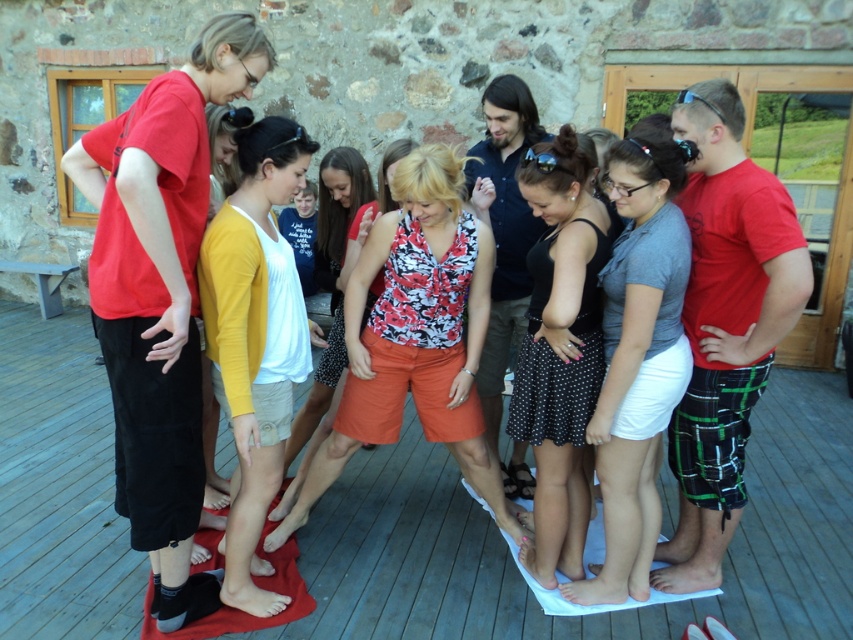
Consider the image. You are a photographer trying to capture a candid shot of the matte red shirt at left and the gray matte skirt at center. Since you want to ensure both are in focus, which one should you focus on first to account for their positions?

You should focus on the matte red shirt at left first because it is located above the gray matte skirt at center, so adjusting focus from top to bottom would ensure both are in frame.

You are a photographer trying to capture a group photo of the people on the wooden deck. You notice the gray matte skirt at center and the yellow cotton cardigan at center. Which clothing item should you focus on if you want to highlight something smaller in size?

The gray matte skirt at center has a smaller size compared to the yellow cotton cardigan at center, so you should focus on the gray matte skirt at center to highlight the smaller clothing item.

You are a photographer taking a group photo of the matte red shirt at left and the black dotted skirt at center. To ensure both are in the frame, which direction should you move the camera to the right? Explain your reasoning based on their positions.

The matte red shirt at left is to the left of the black dotted skirt at center. To include both in the frame, move the camera to the right slightly so that the left edge of the frame captures the matte red shirt at left while the center includes the black dotted skirt at center.